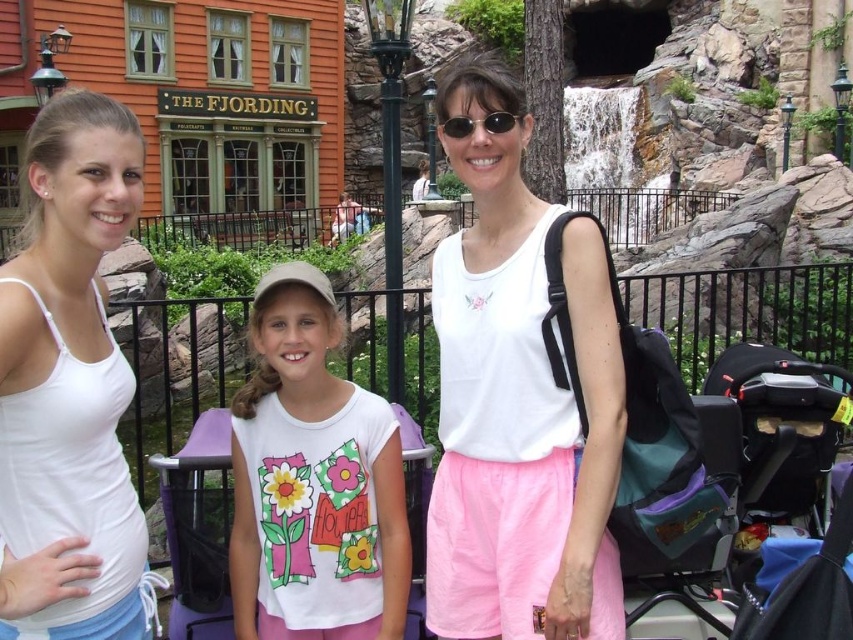
Is white cotton tank top at center bigger than black plastic sunglasses at center?

Yes.

Who is taller, white cotton tank top at center or black plastic sunglasses at center?

Standing taller between the two is white cotton tank top at center.

Does point (480, 195) come in front of point (498, 115)?

No, (480, 195) is behind (498, 115).

Locate an element on the screen. This screenshot has width=853, height=640. white cotton tank top at center is located at coordinates (518, 401).

Does white cotton tank top at center appear under purple fabric stroller at center?

Incorrect, white cotton tank top at center is not positioned below purple fabric stroller at center.

Is white cotton tank top at center shorter than purple fabric stroller at center?

No.

Locate an element on the screen. The width and height of the screenshot is (853, 640). white cotton tank top at center is located at coordinates [518, 401].

Locate an element on the screen. The image size is (853, 640). white cotton tank top at center is located at coordinates (518, 401).

The width and height of the screenshot is (853, 640). I want to click on white cotton tank top at center, so click(518, 401).

Between white cotton tank top at center and white cotton shirt at center, which one is positioned lower?

A: white cotton shirt at center

Between point (527, 609) and point (248, 636), which one is positioned behind?

Positioned behind is point (248, 636).

Find the location of a particular element. This screenshot has width=853, height=640. white cotton tank top at center is located at coordinates (518, 401).